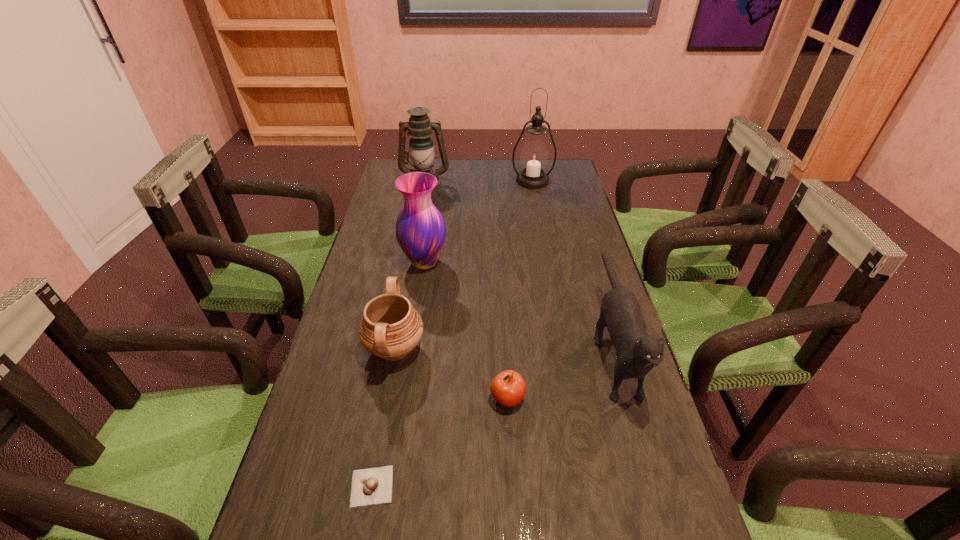
The height and width of the screenshot is (540, 960). In order to click on garlic that is at the left edge in this screenshot , I will do `click(373, 486)`.

Where is `oil lamp positioned at the right edge`? Image resolution: width=960 pixels, height=540 pixels. oil lamp positioned at the right edge is located at coordinates (534, 156).

Where is `cat located in the right edge section of the desktop`? This screenshot has height=540, width=960. cat located in the right edge section of the desktop is located at coordinates (637, 352).

The width and height of the screenshot is (960, 540). What are the coordinates of `object that is at the far left corner` in the screenshot? It's located at [421, 146].

This screenshot has width=960, height=540. I want to click on object that is at the far right corner, so click(534, 156).

This screenshot has width=960, height=540. I want to click on free space at the far edge, so click(x=455, y=162).

In the image, there is a desktop. What are the coordinates of `vacant space at the left edge` in the screenshot? It's located at [x=361, y=271].

Identify the location of vacant space at the right edge. This screenshot has width=960, height=540. (594, 277).

At what (x,y) coordinates should I click in order to perform the action: click on free space at the far right corner of the desktop. Please return your answer as a coordinate pair (x, y). The image size is (960, 540). Looking at the image, I should click on (550, 181).

Identify the location of unoccupied area between the second shortest object and the garlic. The height and width of the screenshot is (540, 960). (440, 442).